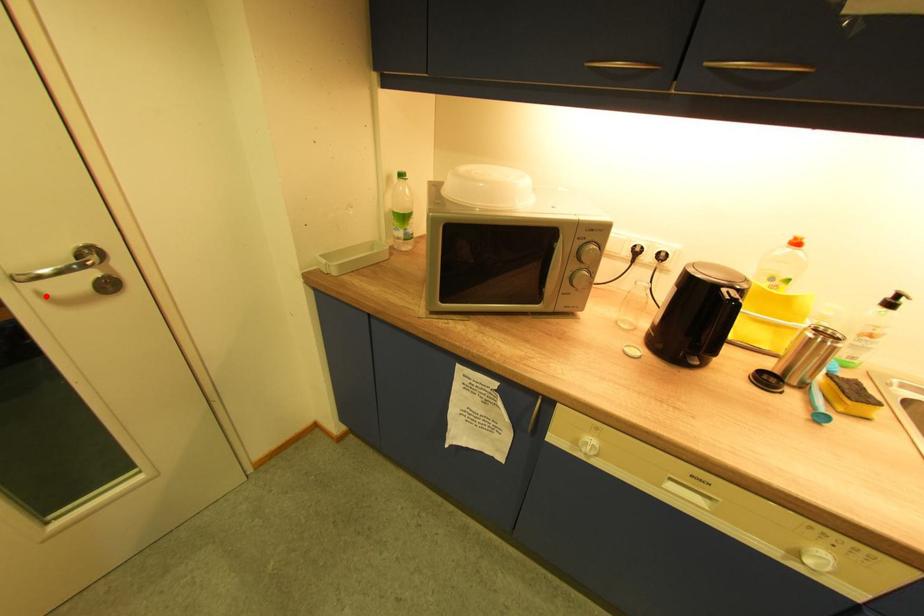
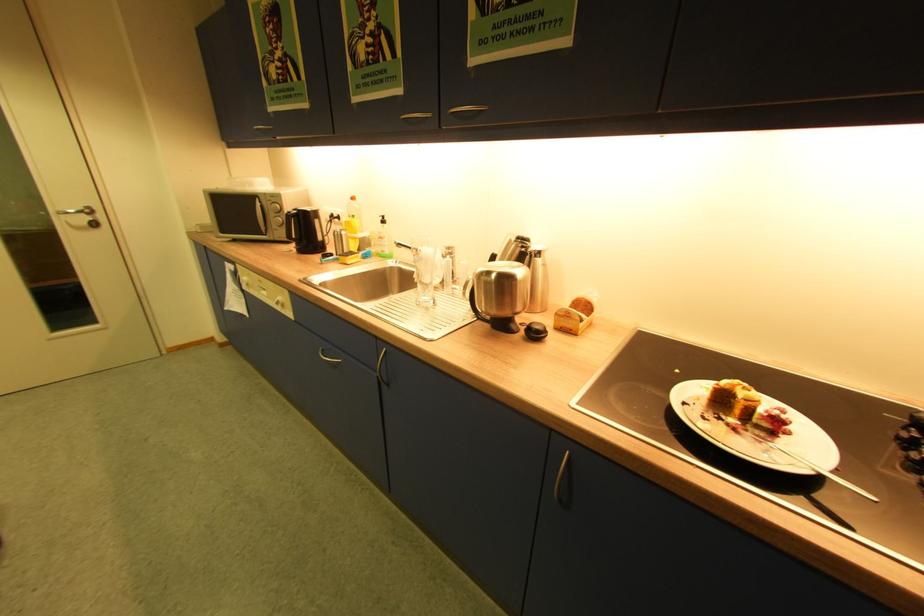
Question: I am providing you with two images of the same scene from different viewpoints. A red point is shown in image1. For the corresponding object point in image2, is it positioned nearer or farther from the camera?

Choices:
 (A) Nearer
 (B) Farther

Answer: (B)